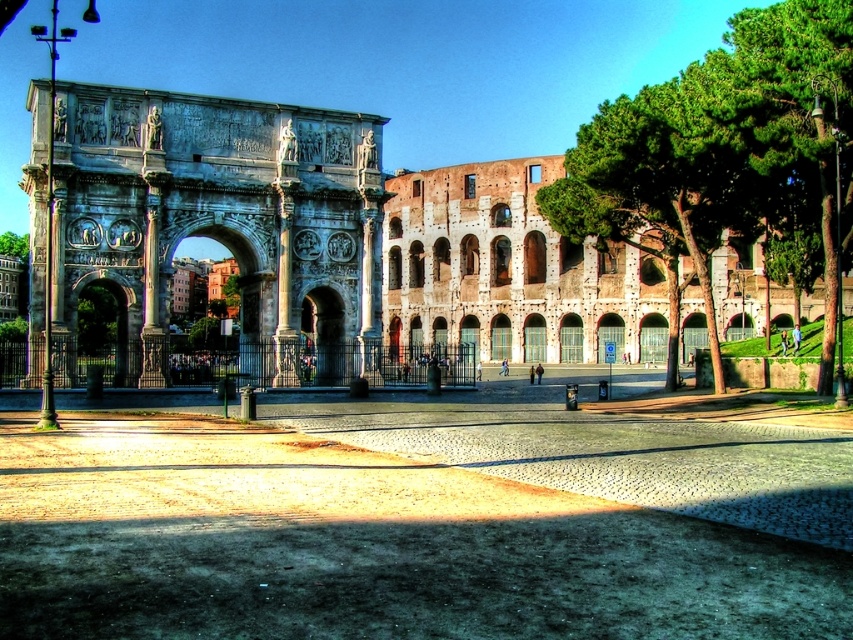
Question: Does stone archway at left lie behind green leafy tree at right?

Choices:
 (A) yes
 (B) no

Answer: (A)

Question: From the image, what is the correct spatial relationship of stone archway at left in relation to green leafy tree at right?

Choices:
 (A) below
 (B) above

Answer: (A)

Question: Among these objects, which one is farthest from the camera?

Choices:
 (A) stone archway at left
 (B) green leafy tree at right

Answer: (A)

Question: Among these points, which one is nearest to the camera?

Choices:
 (A) (700, 61)
 (B) (85, 84)

Answer: (B)

Question: Which object is closer to the camera taking this photo?

Choices:
 (A) green leafy tree at right
 (B) stone archway at left

Answer: (A)

Question: Can you confirm if stone archway at left is wider than green leafy tree at right?

Choices:
 (A) no
 (B) yes

Answer: (A)